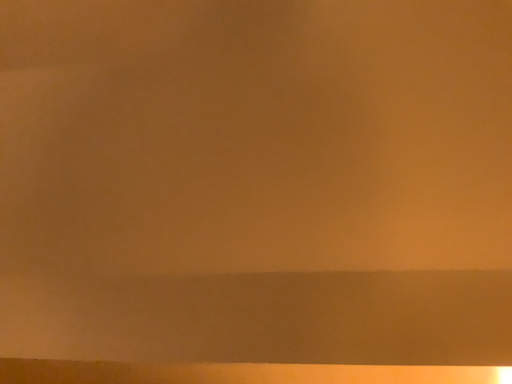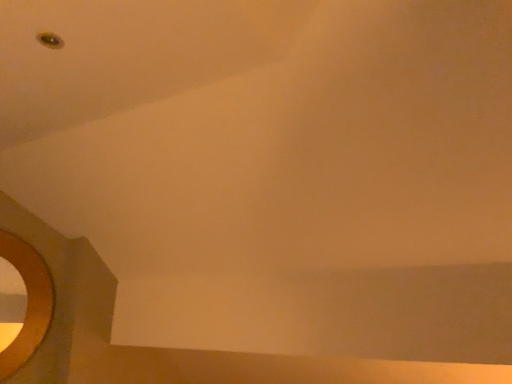
Question: How did the camera likely rotate when shooting the video?

Choices:
 (A) rotated left
 (B) rotated right

Answer: (A)